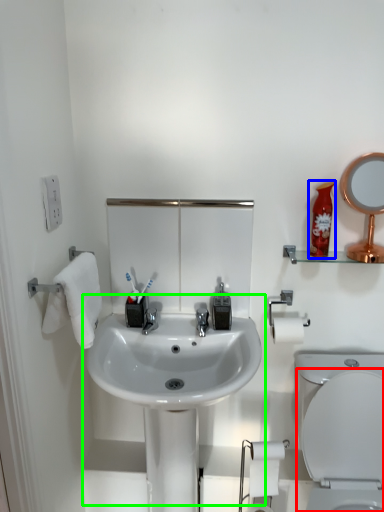
Question: Based on their relative distances, which object is farther from toilet (highlighted by a red box)? Choose from mouthwash (highlighted by a blue box) and sink (highlighted by a green box).

Choices:
 (A) mouthwash
 (B) sink

Answer: (A)